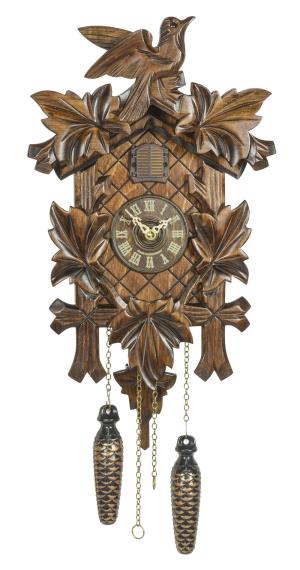
Where is `clockface`? The height and width of the screenshot is (570, 300). clockface is located at coordinates (156, 209).